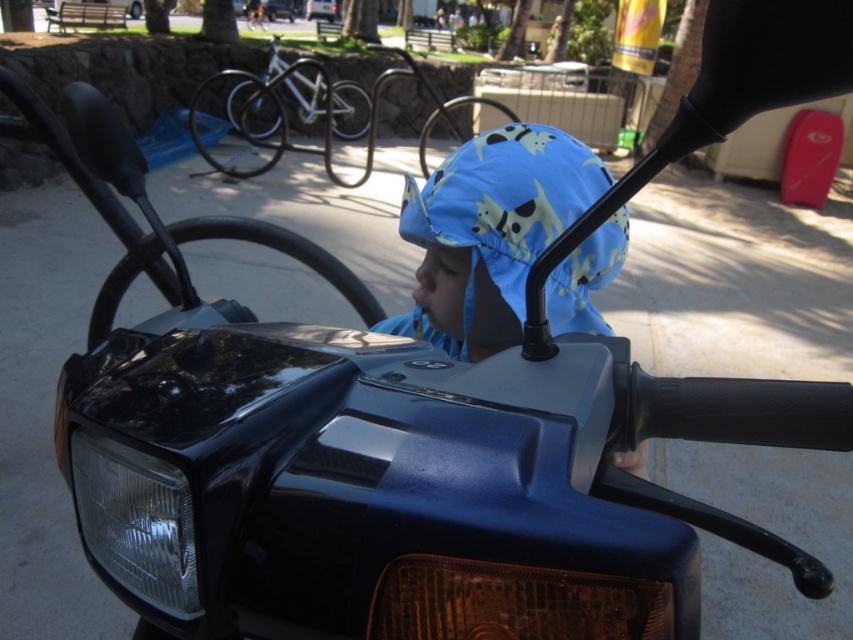
Question: Is blue fabric hat at center bigger than clear glass headlight at lower left?

Choices:
 (A) yes
 (B) no

Answer: (A)

Question: Considering the relative positions of blue fabric hat at center and clear glass headlight at lower left in the image provided, where is blue fabric hat at center located with respect to clear glass headlight at lower left?

Choices:
 (A) left
 (B) right

Answer: (B)

Question: Is blue fabric hat at center closer to the viewer compared to clear glass headlight at lower left?

Choices:
 (A) no
 (B) yes

Answer: (A)

Question: Which point is farther from the camera taking this photo?

Choices:
 (A) (552, 291)
 (B) (163, 557)

Answer: (A)

Question: Which point is farther from the camera taking this photo?

Choices:
 (A) (181, 552)
 (B) (556, 150)

Answer: (B)

Question: Which of the following is the closest to the observer?

Choices:
 (A) (494, 134)
 (B) (86, 524)

Answer: (B)